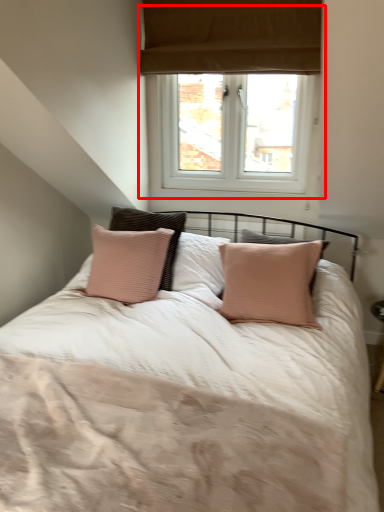
Question: Observing the image, what is the correct spatial positioning of window (annotated by the red box) in reference to bed?

Choices:
 (A) left
 (B) right

Answer: (B)